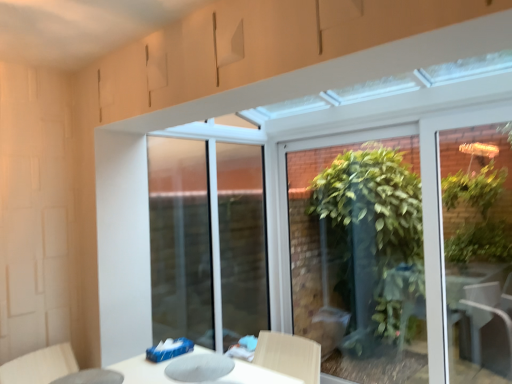
Question: Is transparent glass table at lower left oriented towards light beige fabric swivel chair at lower left?

Choices:
 (A) no
 (B) yes

Answer: (B)

Question: Is transparent glass table at lower left in front of light beige fabric swivel chair at lower left?

Choices:
 (A) yes
 (B) no

Answer: (A)

Question: Does transparent glass table at lower left have a lesser width compared to light beige fabric swivel chair at lower left?

Choices:
 (A) no
 (B) yes

Answer: (B)

Question: Can you confirm if transparent glass table at lower left is taller than light beige fabric swivel chair at lower left?

Choices:
 (A) no
 (B) yes

Answer: (A)

Question: Does transparent glass table at lower left appear on the right side of light beige fabric swivel chair at lower left?

Choices:
 (A) yes
 (B) no

Answer: (A)

Question: Considering the positions of point (53, 367) and point (106, 382), is point (53, 367) closer or farther from the camera than point (106, 382)?

Choices:
 (A) closer
 (B) farther

Answer: (B)

Question: Looking at the image, does light beige fabric swivel chair at lower left seem bigger or smaller compared to transparent glass table at lower left?

Choices:
 (A) small
 (B) big

Answer: (B)

Question: From the image's perspective, is light beige fabric swivel chair at lower left above or below transparent glass table at lower left?

Choices:
 (A) above
 (B) below

Answer: (B)

Question: From a real-world perspective, is light beige fabric swivel chair at lower left above or below transparent glass table at lower left?

Choices:
 (A) above
 (B) below

Answer: (B)

Question: In terms of size, does transparent glass table at lower left appear bigger or smaller than green leafy plant at center?

Choices:
 (A) small
 (B) big

Answer: (A)

Question: Considering the positions of transparent glass table at lower left and green leafy plant at center in the image, is transparent glass table at lower left wider or thinner than green leafy plant at center?

Choices:
 (A) thin
 (B) wide

Answer: (B)

Question: Is point (73, 379) positioned closer to the camera than point (365, 380)?

Choices:
 (A) farther
 (B) closer

Answer: (B)

Question: Is transparent glass table at lower left to the left or to the right of green leafy plant at center in the image?

Choices:
 (A) left
 (B) right

Answer: (A)

Question: Considering the positions of green leafy plant at center and transparent glass table at lower left in the image, is green leafy plant at center wider or thinner than transparent glass table at lower left?

Choices:
 (A) thin
 (B) wide

Answer: (A)

Question: From the image's perspective, is green leafy plant at center located above or below transparent glass table at lower left?

Choices:
 (A) above
 (B) below

Answer: (A)